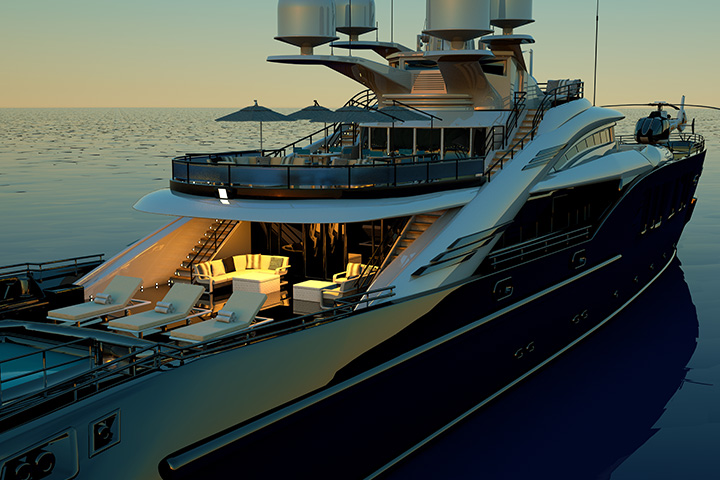
Locate an element on the screen. The image size is (720, 480). lounge chair is located at coordinates (86, 309), (129, 324), (193, 336).